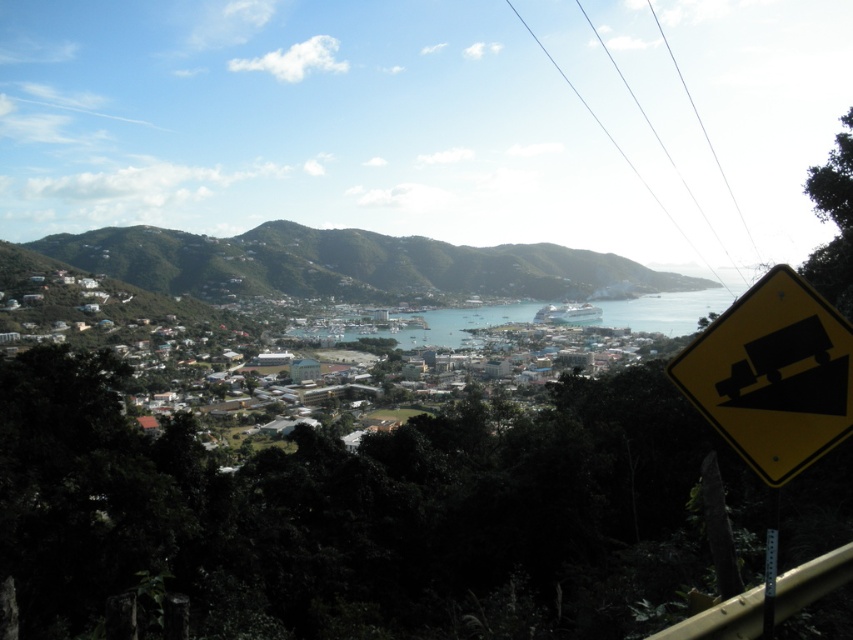
Question: Which of the following is the farthest from the observer?

Choices:
 (A) green grassy hillside at upper left
 (B) yellow plastic sign at lower right

Answer: (A)

Question: Considering the relative positions of green grassy hillside at upper left and yellow plastic sign at lower right in the image provided, where is green grassy hillside at upper left located with respect to yellow plastic sign at lower right?

Choices:
 (A) below
 (B) above

Answer: (B)

Question: Can you confirm if yellow plastic sign at lower right is positioned to the right of blue water at center?

Choices:
 (A) yes
 (B) no

Answer: (B)

Question: Which of the following is the farthest from the observer?

Choices:
 (A) (601, 301)
 (B) (248, 276)
 (C) (804, 326)

Answer: (A)

Question: Is green grassy hillside at upper left to the left of yellow plastic sign at lower right from the viewer's perspective?

Choices:
 (A) yes
 (B) no

Answer: (A)

Question: Which is nearer to the blue water at center?

Choices:
 (A) green grassy hillside at upper left
 (B) yellow plastic sign at lower right

Answer: (A)